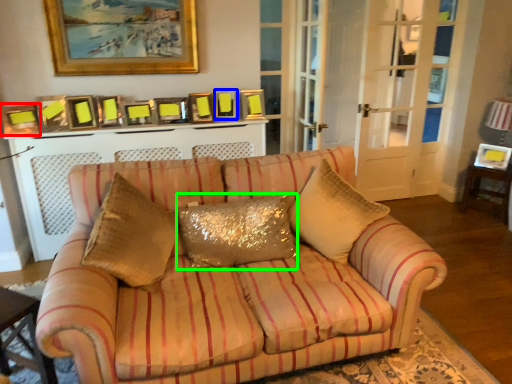
Question: Based on their relative distances, which object is nearer to picture frame (highlighted by a red box)? Choose from picture frame (highlighted by a blue box) and pillow (highlighted by a green box).

Choices:
 (A) picture frame
 (B) pillow

Answer: (A)